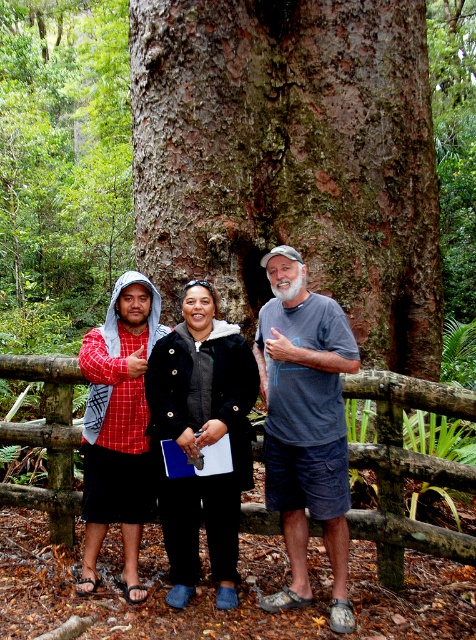
In the scene shown: You are planning to take a photo of the black fuzzy jacket at center and the wooden at center. Which object should you focus on first if you want to capture both in the frame without moving the camera?

You should focus on the wooden at center first because it occupies more space than the black fuzzy jacket at center, allowing you to ensure it fits properly in the frame before adjusting for the smaller object.